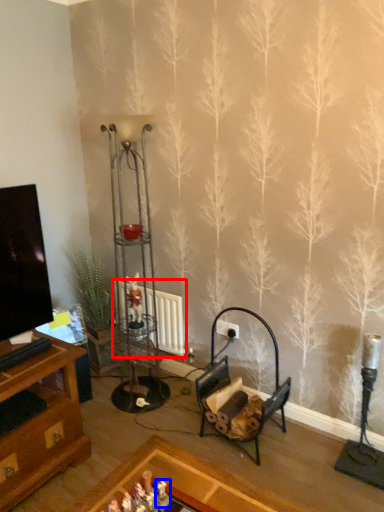
Question: Which point is closer to the camera, radiator (highlighted by a red box) or toy (highlighted by a blue box)?

Choices:
 (A) radiator
 (B) toy

Answer: (B)